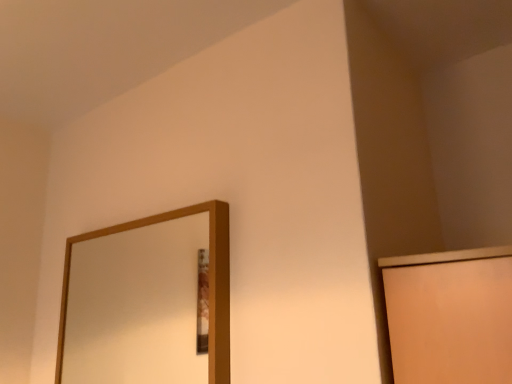
Question: Should I look upward or downward to see wooden mirror at upper left?

Choices:
 (A) down
 (B) up

Answer: (A)